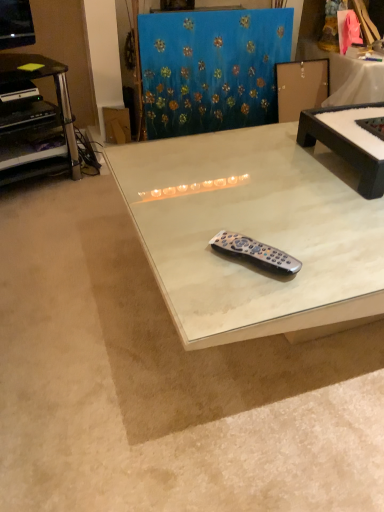
Question: Choose the correct answer: Is black plastic desk at left inside blue textured fabric at upper center or outside it?

Choices:
 (A) inside
 (B) outside

Answer: (B)

Question: Does point (26, 132) appear closer or farther from the camera than point (170, 128)?

Choices:
 (A) closer
 (B) farther

Answer: (A)

Question: Which object is positioned closest to the white marble table at center, the second table from the right?

Choices:
 (A) black plastic remote at center
 (B) black matte table at center, the 1th table in the right-to-left sequence
 (C) black plastic desk at left
 (D) blue textured fabric at upper center
 (E) cardboard at upper left

Answer: (A)

Question: Which is nearer to the cardboard at upper left?

Choices:
 (A) black plastic desk at left
 (B) black matte table at center, the 2th table from the left
 (C) blue textured fabric at upper center
 (D) white marble table at center, the second table from the right
 (E) black plastic remote at center

Answer: (A)